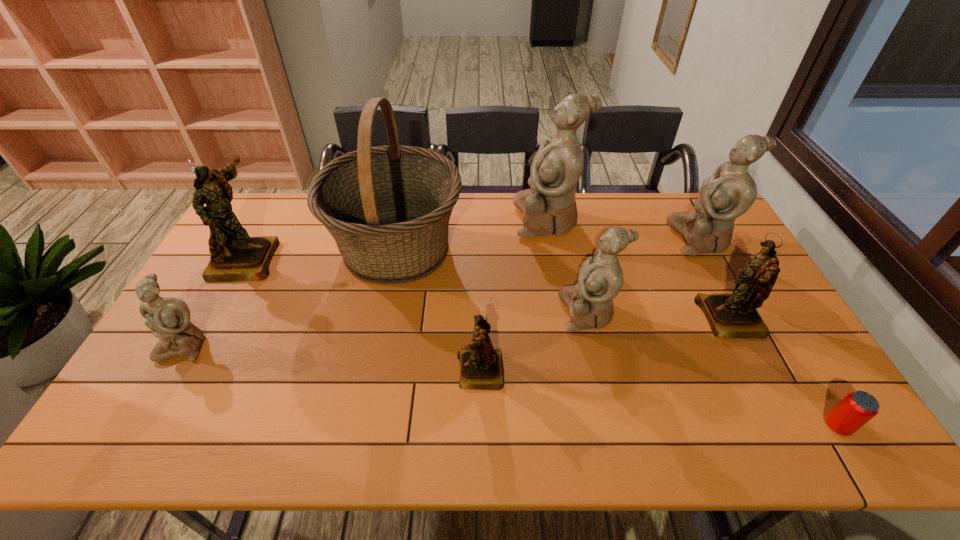
The width and height of the screenshot is (960, 540). I want to click on vacant position in the image that satisfies the following two spatial constraints: 1. on the front-facing side of the second gold figurine from right to left; 2. on the right side of the nearest object, so click(480, 426).